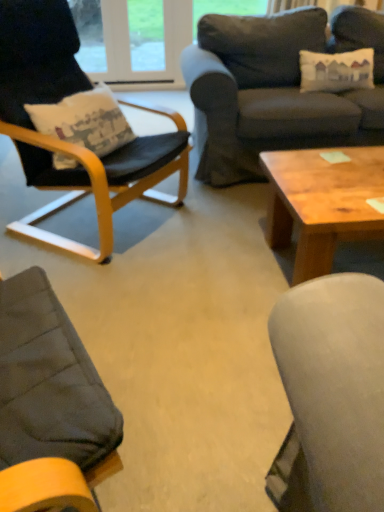
At what (x,y) coordinates should I click in order to perform the action: click on vacant space that's between wooden coffee table at center and black leather chair at left. Please return your answer as a coordinate pair (x, y). The height and width of the screenshot is (512, 384). Looking at the image, I should click on (212, 245).